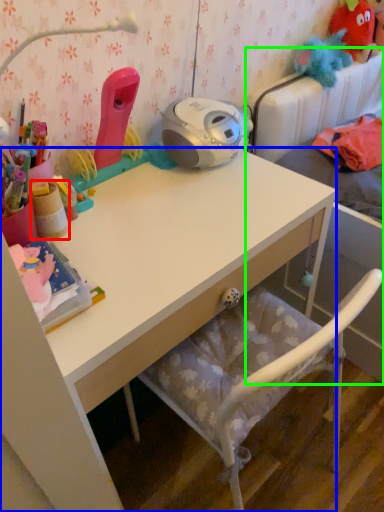
Question: Considering the real-world distances, which object is farthest from stationery (highlighted by a red box)? desk (highlighted by a blue box) or bed (highlighted by a green box)?

Choices:
 (A) desk
 (B) bed

Answer: (B)